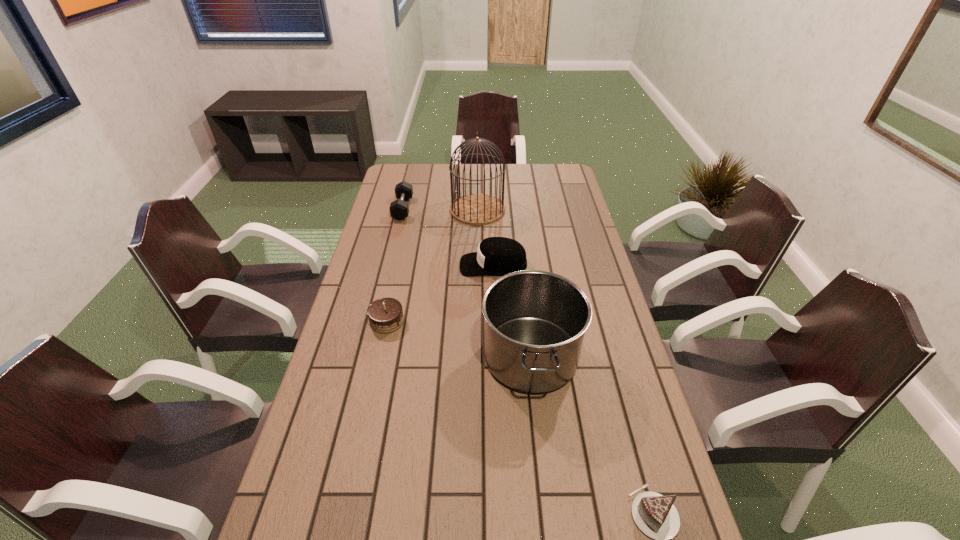
This screenshot has height=540, width=960. In order to click on birdcage in this screenshot , I will do `click(474, 209)`.

This screenshot has height=540, width=960. I want to click on the second tallest object, so click(x=535, y=321).

Where is `the third tallest object`? The height and width of the screenshot is (540, 960). the third tallest object is located at coordinates (496, 255).

Find the location of `the fourth nearest object`. the fourth nearest object is located at coordinates (496, 255).

Find the location of a particular element. the farther chocolate cake is located at coordinates (385, 315).

This screenshot has width=960, height=540. What are the coordinates of `the taller chocolate cake` in the screenshot? It's located at (385, 315).

This screenshot has width=960, height=540. Identify the location of dumbbell. (399, 209).

Image resolution: width=960 pixels, height=540 pixels. I want to click on free space located 0.190m at the door of the birdcage, so click(x=477, y=255).

Image resolution: width=960 pixels, height=540 pixels. Identify the location of free location located 0.230m on the left of the fifth shortest object. (400, 356).

The height and width of the screenshot is (540, 960). Identify the location of vacant space situated on the front-facing side of the third farthest object. (363, 265).